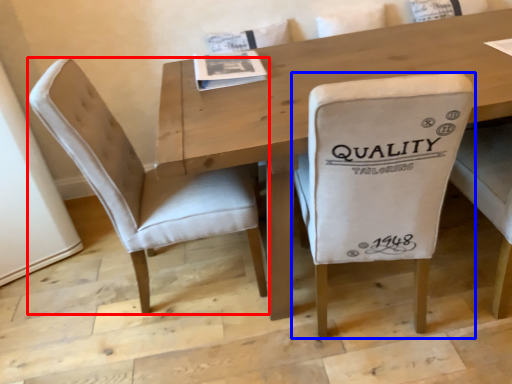
Question: Among these objects, which one is farthest to the camera, chair (highlighted by a red box) or chair (highlighted by a blue box)?

Choices:
 (A) chair
 (B) chair

Answer: (A)